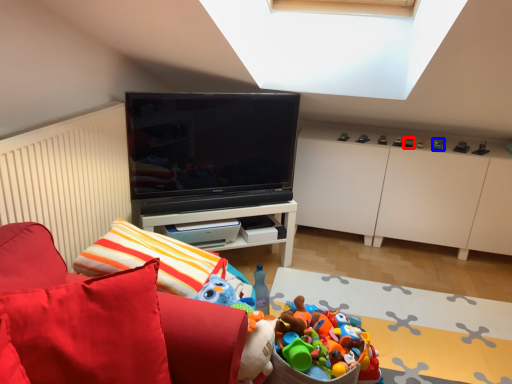
Question: Which object is closer to the camera taking this photo, toy (highlighted by a red box) or toy (highlighted by a blue box)?

Choices:
 (A) toy
 (B) toy

Answer: (B)